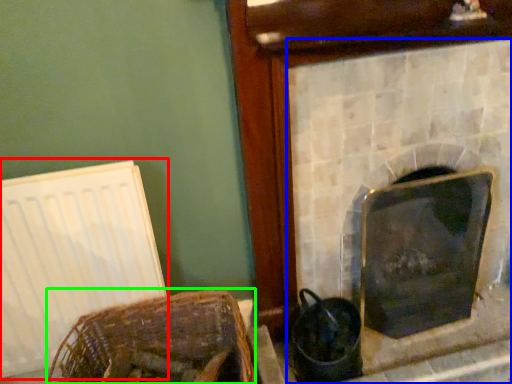
Question: Which object is positioned closest to radiator (highlighted by a red box)? Select from fireplace (highlighted by a blue box) and basket (highlighted by a green box).

Choices:
 (A) fireplace
 (B) basket

Answer: (B)